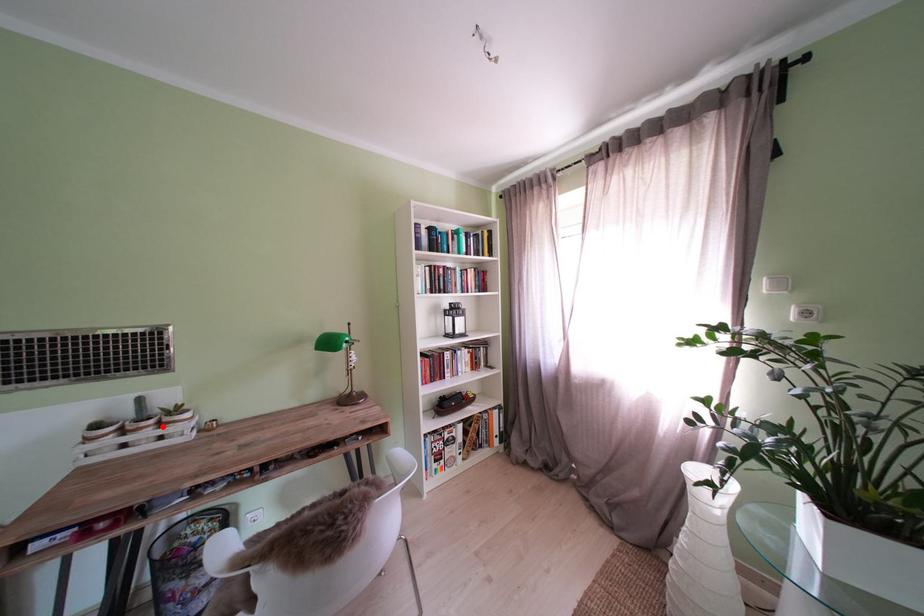
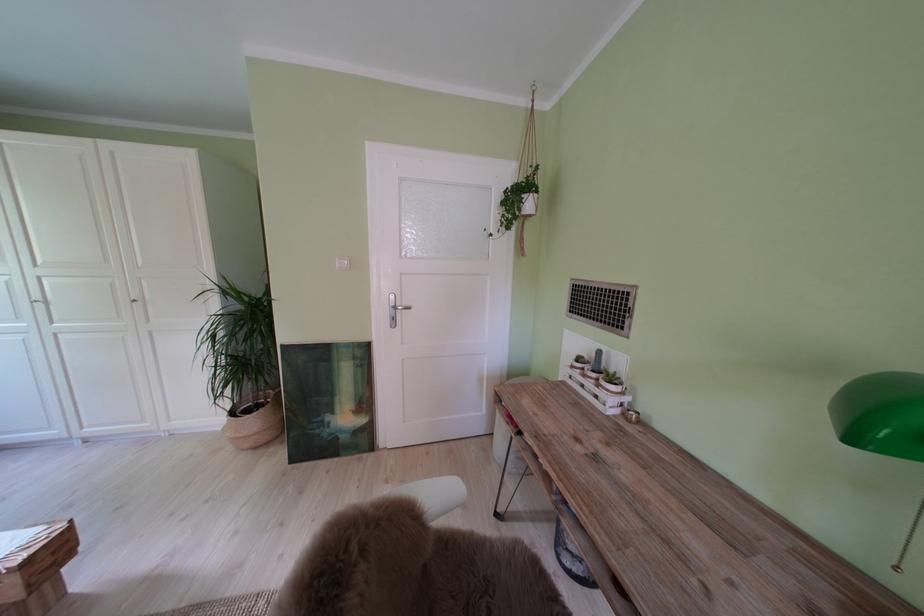
Find the pixel in the second image that matches the highlighted location in the first image.

(604, 381)